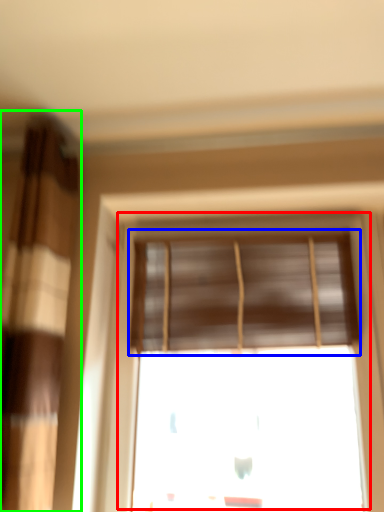
Question: Which is farther away from window (highlighted by a red box)? window blind (highlighted by a blue box) or curtain (highlighted by a green box)?

Choices:
 (A) window blind
 (B) curtain

Answer: (B)